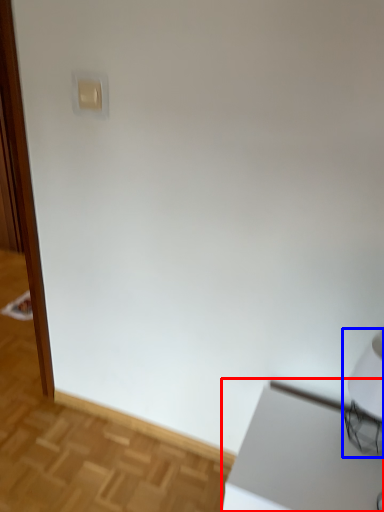
Question: Among these objects, which one is nearest to the camera, table (highlighted by a red box) or table lamp (highlighted by a blue box)?

Choices:
 (A) table
 (B) table lamp

Answer: (A)